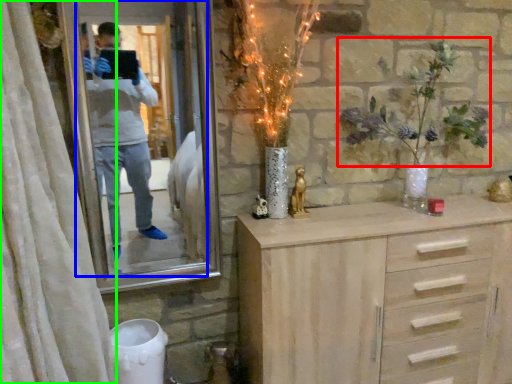
Question: Considering the real-world distances, which object is farthest from floral arrangement (highlighted by a red box)? mirror (highlighted by a blue box) or curtain (highlighted by a green box)?

Choices:
 (A) mirror
 (B) curtain

Answer: (A)